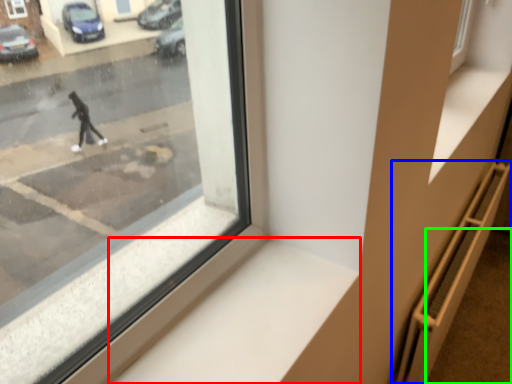
Question: Considering the real-world distances, which object is farthest from window sill (highlighted by a red box)? stairwell (highlighted by a blue box) or pavement (highlighted by a green box)?

Choices:
 (A) stairwell
 (B) pavement

Answer: (B)